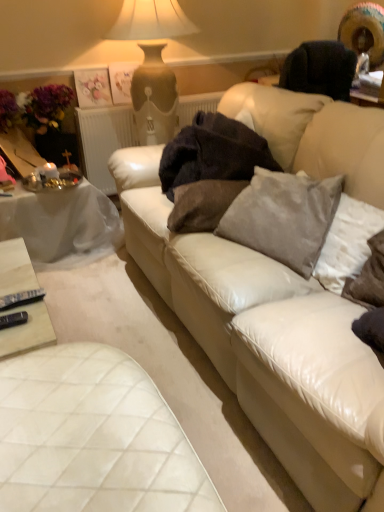
This screenshot has height=512, width=384. In order to click on empty space that is ontop of white quilted leather table at lower left, which is the second table in back-to-front order in this screenshot , I will do `click(80, 432)`.